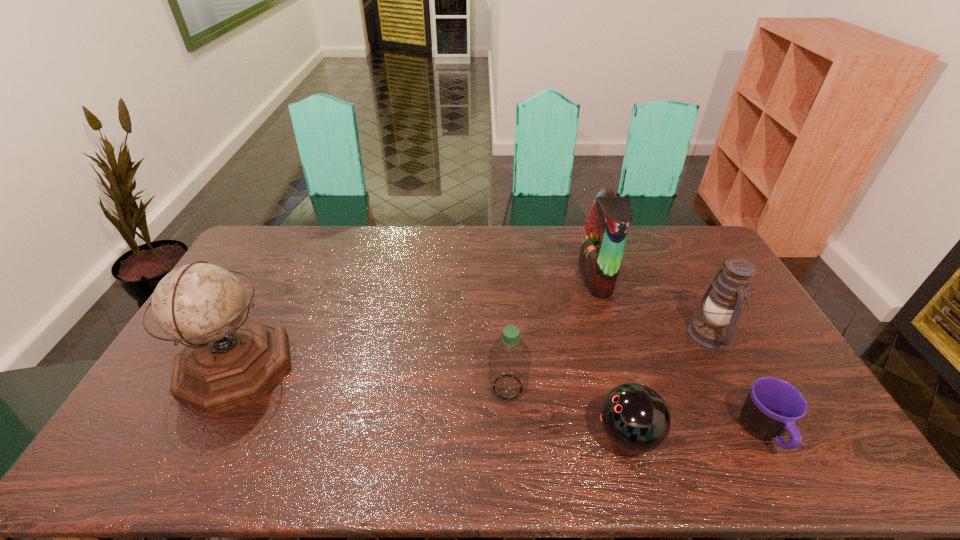
Locate an element on the screen. The width and height of the screenshot is (960, 540). oil lamp that is at the right edge is located at coordinates (722, 304).

Locate an element on the screen. mug present at the right edge is located at coordinates (773, 406).

This screenshot has height=540, width=960. What are the coordinates of `object present at the near right corner` in the screenshot? It's located at (773, 406).

The height and width of the screenshot is (540, 960). I want to click on vacant space at the far edge of the desktop, so click(x=320, y=260).

Identify the location of blank area at the near edge. (737, 477).

The height and width of the screenshot is (540, 960). In the image, there is a desktop. In order to click on vacant space at the far left corner in this screenshot , I will do `click(264, 253)`.

The width and height of the screenshot is (960, 540). What are the coordinates of `free space at the near left corner` in the screenshot? It's located at (131, 465).

I want to click on vacant region at the near right corner of the desktop, so [838, 457].

Where is `free space between the fourth tallest object and the oil lamp`? The height and width of the screenshot is (540, 960). free space between the fourth tallest object and the oil lamp is located at coordinates (609, 361).

Find the location of a particular element. free space between the second shortest object and the oil lamp is located at coordinates (669, 386).